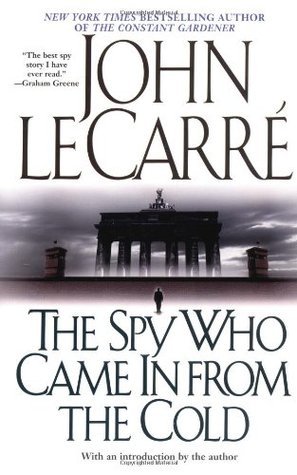
Where is `book`? book is located at coordinates (165, 110).